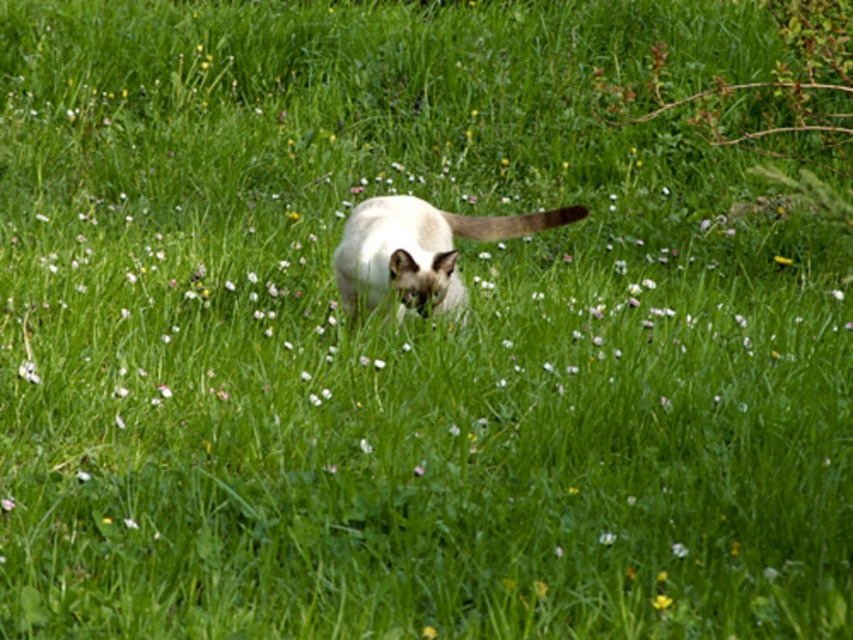
You are a photographer trying to capture the cat in the scene. You want to focus on the point at point (341, 301) and point (653, 600). Which point is closer to your camera?

Point (653, 600) is closer to the camera than point (341, 301), so you should focus on that point first to ensure it is in clear view.

You are a photographer aiming to capture the white fur cat at center and the yellow matte flower at lower right in a single shot. Can you focus on both objects clearly without adjusting your camera settings?

The yellow matte flower at lower right is behind the white fur cat at center, so focusing on both clearly at the same time may not be possible without adjusting your camera settings to increase the depth of field.

You are a photographer trying to capture the white fur cat at center and the yellow matte flower at lower right in the same frame. Which subject is wider so that you can adjust your camera angle accordingly?

The white fur cat at center is wider than the yellow matte flower at lower right, so you should adjust your camera angle to focus more on the cat to capture its full width.